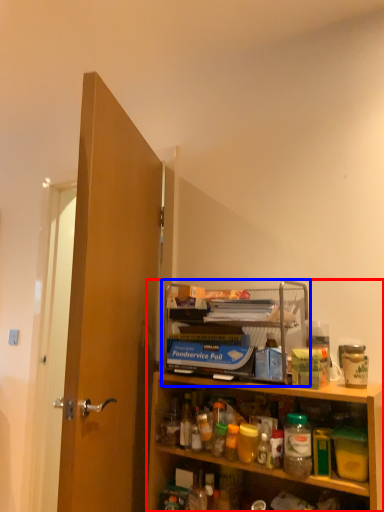
Question: Among these objects, which one is farthest to the camera, cabinetry (highlighted by a red box) or shelf (highlighted by a blue box)?

Choices:
 (A) cabinetry
 (B) shelf

Answer: (B)